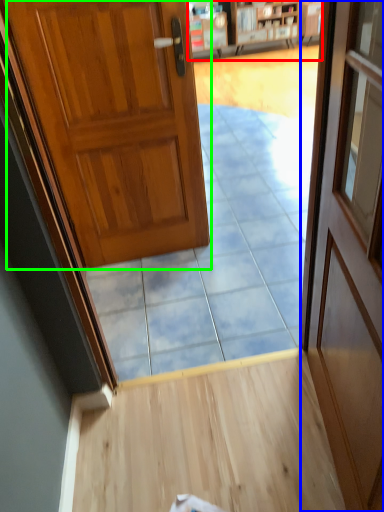
Question: Based on their relative distances, which object is farther from bookshelf (highlighted by a red box)? Choose from door (highlighted by a blue box) and door (highlighted by a green box).

Choices:
 (A) door
 (B) door

Answer: (A)